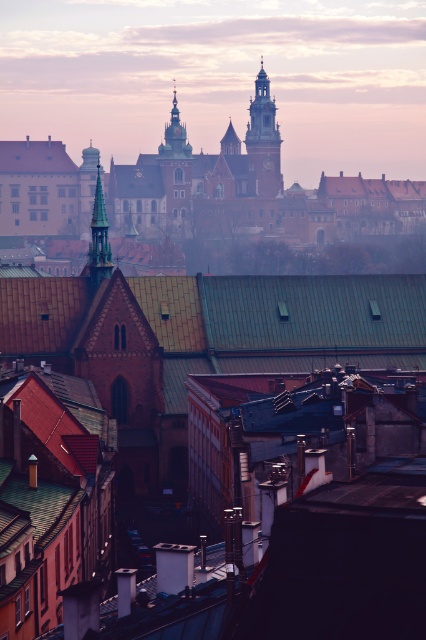
Question: From the image, what is the correct spatial relationship of foggy atmosphere at upper center in relation to smooth green spire at center?

Choices:
 (A) left
 (B) right

Answer: (B)

Question: Which object is positioned farthest from the foggy atmosphere at upper center?

Choices:
 (A) gold textured spire at upper center
 (B) smooth green spire at center
 (C) brick tower at center

Answer: (B)

Question: Which object is closer to the camera taking this photo?

Choices:
 (A) gold textured spire at upper center
 (B) foggy atmosphere at upper center

Answer: (A)

Question: Is brick tower at center thinner than smooth green spire at center?

Choices:
 (A) yes
 (B) no

Answer: (B)

Question: Is foggy atmosphere at upper center bigger than brick tower at center?

Choices:
 (A) yes
 (B) no

Answer: (A)

Question: Among these objects, which one is nearest to the camera?

Choices:
 (A) foggy atmosphere at upper center
 (B) smooth green spire at center
 (C) brick tower at center

Answer: (B)